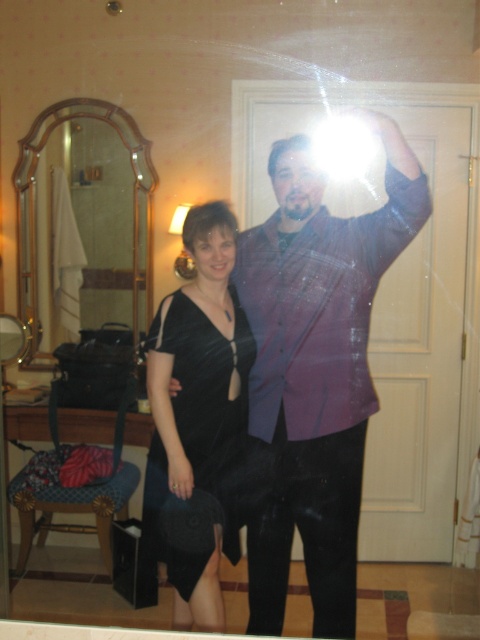
Question: Is the position of black satin dress at left less distant than that of gold-framed mirror at left?

Choices:
 (A) no
 (B) yes

Answer: (B)

Question: Is black satin dress at left to the right of gold-framed mirror at left from the viewer's perspective?

Choices:
 (A) yes
 (B) no

Answer: (A)

Question: Which of these objects is positioned farthest from the black satin dress at left?

Choices:
 (A) gold-framed mirror at left
 (B) black velvet dress at center

Answer: (A)

Question: Is black satin dress at left to the left of gold-framed mirror at left from the viewer's perspective?

Choices:
 (A) yes
 (B) no

Answer: (B)

Question: Which object appears farthest from the camera in this image?

Choices:
 (A) gold-framed mirror at left
 (B) black satin dress at left

Answer: (A)

Question: Which point is closer to the camera taking this photo?

Choices:
 (A) (39, 124)
 (B) (213, 449)

Answer: (B)